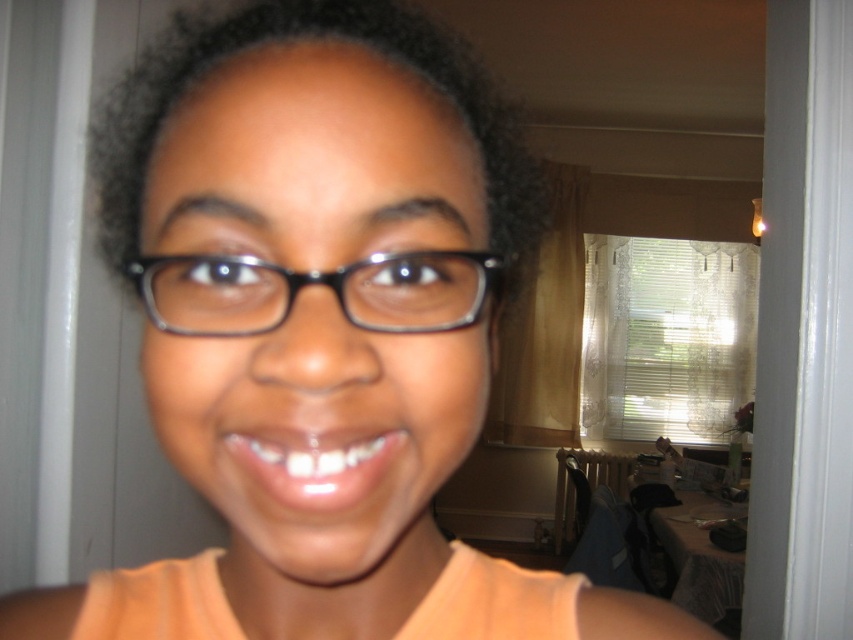
You are a photographer trying to capture the black plastic glasses at center clearly. However, the dark curly hair at center is blocking the view. Can you adjust your position to see the glasses without moving the objects?

The black plastic glasses at center is behind dark curly hair at center, so moving your position slightly might allow you to see around the hair to view the glasses without moving the objects.

You are a photographer adjusting your camera settings. You notice two points in the scene labeled as point (519, 131) and point (166, 310). Which of these points is closer to the camera lens?

Point (519, 131) is further to the camera than point (166, 310), so the point closer to the camera lens is point (166, 310).